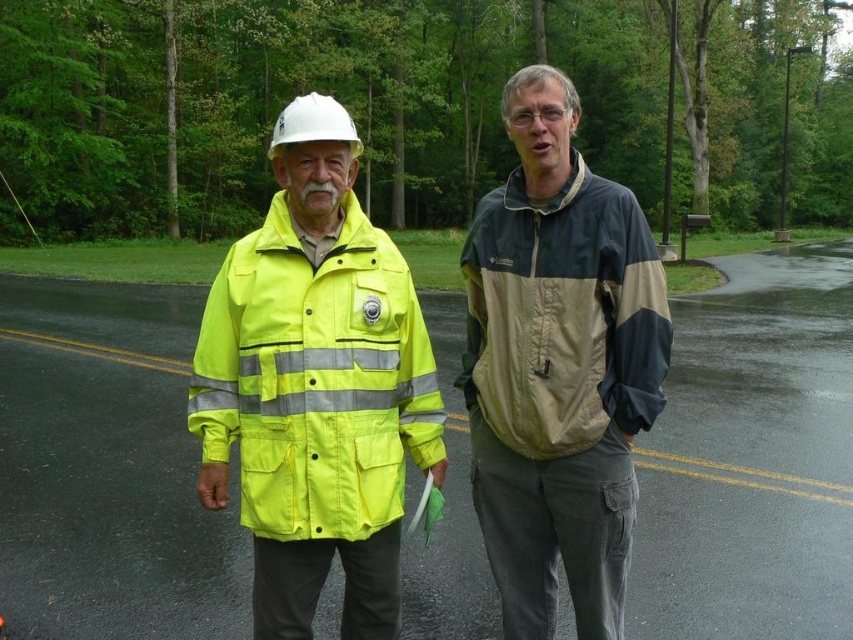
Between point (656, 296) and point (332, 102), which one is positioned in front?

Point (332, 102) is in front.

Between point (529, 540) and point (334, 128), which one is positioned behind?

Positioned behind is point (529, 540).

Describe the element at coordinates (558, 368) in the screenshot. The image size is (853, 640). I see `high-visibility yellow jacket at center` at that location.

Find the location of `high-visibility yellow jacket at center`. high-visibility yellow jacket at center is located at coordinates (558, 368).

Does high-visibility fabric jacket at left appear over white hard hat at center?

Incorrect, high-visibility fabric jacket at left is not positioned above white hard hat at center.

Can you confirm if high-visibility fabric jacket at left is positioned to the right of white hard hat at center?

Correct, you'll find high-visibility fabric jacket at left to the right of white hard hat at center.

Describe the element at coordinates (315, 380) in the screenshot. I see `high-visibility fabric jacket at left` at that location.

Where is `high-visibility fabric jacket at left`? Image resolution: width=853 pixels, height=640 pixels. high-visibility fabric jacket at left is located at coordinates (315, 380).

What do you see at coordinates (558, 368) in the screenshot? I see `high-visibility yellow jacket at center` at bounding box center [558, 368].

Does point (492, 540) come closer to viewer compared to point (363, 225)?

No, (492, 540) is further to viewer.

Locate an element on the screen. This screenshot has width=853, height=640. high-visibility yellow jacket at center is located at coordinates (558, 368).